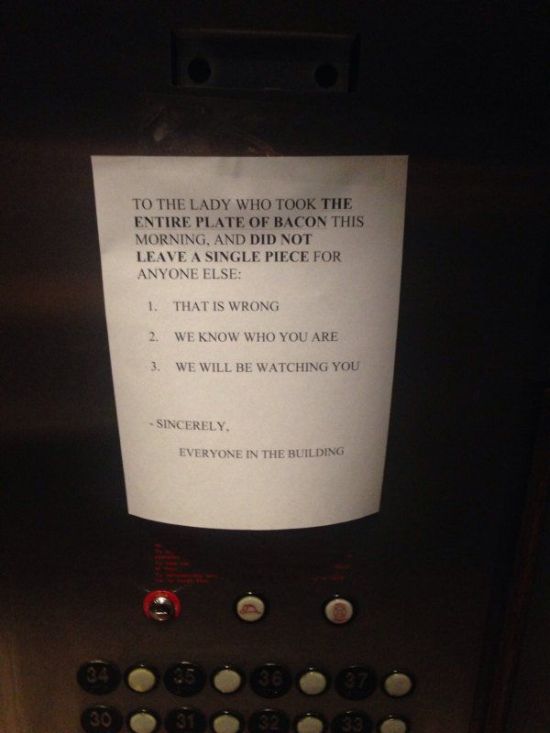
Find the location of a particular element. This screenshot has width=550, height=733. floor labels is located at coordinates (354, 682), (353, 726), (266, 721), (273, 677), (188, 677), (184, 723), (99, 714), (94, 668).